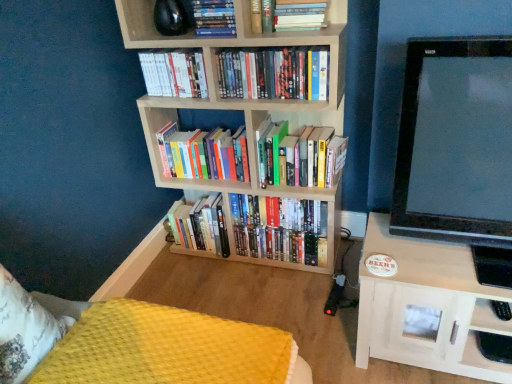
Describe the element at coordinates (288, 15) in the screenshot. Image resolution: width=512 pixels, height=384 pixels. I see `hardcover book at upper center, placed as the second book when sorted from top to bottom` at that location.

The image size is (512, 384). What do you see at coordinates (201, 226) in the screenshot? I see `hardcover books at center, the 8th book from the top` at bounding box center [201, 226].

Find the location of a particular element. white wood shelf at right is located at coordinates (425, 305).

Measure the distance between yellow textured blanket at lower left and camera.

The distance of yellow textured blanket at lower left from camera is 1.05 meters.

Where is `hardcover books at center, the 6th book viewed from the top`? This screenshot has height=384, width=512. hardcover books at center, the 6th book viewed from the top is located at coordinates (300, 155).

Find the location of a particular element. The width and height of the screenshot is (512, 384). light wood bookcase at center is located at coordinates (217, 84).

The width and height of the screenshot is (512, 384). I want to click on hardcover books at center, the fifth book when ordered from bottom to top, so click(274, 73).

Find the location of a particular element. The width and height of the screenshot is (512, 384). hardcover books at upper center, which is the eighth book from bottom to top is located at coordinates (214, 18).

Would you say hardcover book at upper center, placed as the second book when sorted from top to bottom, is outside hardcover books at center, the 6th book viewed from the top?

hardcover book at upper center, placed as the second book when sorted from top to bottom, lies outside hardcover books at center, the 6th book viewed from the top,'s area.

Based on the photo, is hardcover book at upper center, which is counted as the seventh book, starting from the bottom, next to hardcover books at center, the 6th book viewed from the top, and touching it?

No, hardcover book at upper center, which is counted as the seventh book, starting from the bottom, is not with hardcover books at center, the 6th book viewed from the top.

Between point (262, 12) and point (310, 178), which one is positioned in front?

The point (262, 12) is closer.

From the hardcover books at center, the 6th book viewed from the top, count 2nd books forward and point to it. Please provide its 2D coordinates.

[(288, 15)]

From the image's perspective, starting from the white wood shelf at right, which book is the 5th one above? Please provide its 2D coordinates.

[(274, 73)]

Looking at this image, considering the relative positions of white wood shelf at right and hardcover books at center, the fifth book when ordered from bottom to top, in the image provided, is white wood shelf at right to the right of hardcover books at center, the fifth book when ordered from bottom to top, from the viewer's perspective?

Correct, you'll find white wood shelf at right to the right of hardcover books at center, the fifth book when ordered from bottom to top.

From a real-world perspective, is white wood shelf at right physically located above or below hardcover books at center, placed as the fourth book when sorted from top to bottom?

Clearly, from a real-world perspective, white wood shelf at right is below hardcover books at center, placed as the fourth book when sorted from top to bottom.

Between white wood shelf at right and hardcover books at center, placed as the fourth book when sorted from top to bottom, which one has smaller size?

hardcover books at center, placed as the fourth book when sorted from top to bottom.

Which is correct: hardcover books at upper center, which is the eighth book from bottom to top, is inside hardcover book at upper center, placed as the second book when sorted from top to bottom, or outside of it?

hardcover books at upper center, which is the eighth book from bottom to top, is located beyond the bounds of hardcover book at upper center, placed as the second book when sorted from top to bottom.

Considering the sizes of objects hardcover books at upper center, acting as the 1th book starting from the top, and hardcover book at upper center, placed as the second book when sorted from top to bottom, in the image provided, who is shorter, hardcover books at upper center, acting as the 1th book starting from the top, or hardcover book at upper center, placed as the second book when sorted from top to bottom,?

Standing shorter between the two is hardcover book at upper center, placed as the second book when sorted from top to bottom.

Is hardcover books at upper center, acting as the 1th book starting from the top, positioned behind hardcover book at upper center, placed as the second book when sorted from top to bottom?

That is False.

Which of these two, hardcover books at upper center, which is the eighth book from bottom to top, or yellow textured blanket at lower left, is thinner?

Thinner between the two is hardcover books at upper center, which is the eighth book from bottom to top.

Is hardcover books at upper center, acting as the 1th book starting from the top, to the left of yellow textured blanket at lower left from the viewer's perspective?

Incorrect, hardcover books at upper center, acting as the 1th book starting from the top, is not on the left side of yellow textured blanket at lower left.

From a real-world perspective, relative to yellow textured blanket at lower left, is hardcover books at upper center, which is the eighth book from bottom to top, vertically above or below?

From a real-world perspective, hardcover books at upper center, which is the eighth book from bottom to top, is physically above yellow textured blanket at lower left.

Which object is closer to the camera taking this photo, hardcover books at center, which ranks as the 5th book in top-to-bottom order, or yellow textured blanket at lower left?

yellow textured blanket at lower left.

From the image's perspective, is hardcover books at center, placed as the fourth book when sorted from bottom to top, above or below yellow textured blanket at lower left?

Based on their image positions, hardcover books at center, placed as the fourth book when sorted from bottom to top, is located above yellow textured blanket at lower left.

Considering the sizes of hardcover books at center, which ranks as the 5th book in top-to-bottom order, and yellow textured blanket at lower left in the image, is hardcover books at center, which ranks as the 5th book in top-to-bottom order, wider or thinner than yellow textured blanket at lower left?

In the image, hardcover books at center, which ranks as the 5th book in top-to-bottom order, appears to be more narrow than yellow textured blanket at lower left.

Can you confirm if hardcover books at center, which ranks as the 5th book in top-to-bottom order, is positioned to the right of yellow textured blanket at lower left?

Yes.

In the scene shown: Is hardcover books at upper center, which is the eighth book from bottom to top, positioned far away from hardcover books at center, marked as the 2th book in a bottom-to-top arrangement?

No, hardcover books at upper center, which is the eighth book from bottom to top, is not far away from hardcover books at center, marked as the 2th book in a bottom-to-top arrangement.

Is the position of hardcover books at upper center, acting as the 1th book starting from the top, less distant than that of hardcover books at center, marked as the 2th book in a bottom-to-top arrangement?

Yes, hardcover books at upper center, acting as the 1th book starting from the top, is closer to the viewer.

Considering the sizes of hardcover books at upper center, which is the eighth book from bottom to top, and hardcover books at center, the seventh book when ordered from top to bottom, in the image, is hardcover books at upper center, which is the eighth book from bottom to top, wider or thinner than hardcover books at center, the seventh book when ordered from top to bottom,?

Clearly, hardcover books at upper center, which is the eighth book from bottom to top, has less width compared to hardcover books at center, the seventh book when ordered from top to bottom.

Is point (231, 6) farther from camera compared to point (277, 208)?

No, it is not.

Considering the points (178, 245) and (244, 14), which point is in front, point (178, 245) or point (244, 14)?

Point (244, 14)

What's the angular difference between hardcover books at center, the 8th book from the top, and light wood bookcase at center's facing directions?

The angular difference between hardcover books at center, the 8th book from the top, and light wood bookcase at center is 0.483 degrees.

Between hardcover books at center, the 8th book from the top, and light wood bookcase at center, which one has larger width?

light wood bookcase at center is wider.

Could you tell me if hardcover books at center, the 8th book from the top, is turned towards light wood bookcase at center?

Yes, hardcover books at center, the 8th book from the top, is aimed at light wood bookcase at center.

You are a GUI agent. You are given a task and a screenshot of the screen. Output one action in this format:
    pyautogui.click(x=<x>, y=<y>)
    Task: Click on the book lying on the right of hardcover book at upper center, which is counted as the seventh book, starting from the bottom
    
    Given the screenshot: What is the action you would take?
    click(300, 155)

Which book is the 3rd one when counting from the back of the white wood shelf at right? Please provide its 2D coordinates.

[(274, 73)]

From the image, which object appears to be nearer to hardcover books at center, the seventh book when ordered from top to bottom, hardcover books at center, placed as the fourth book when sorted from top to bottom, or yellow textured blanket at lower left?

Based on the image, hardcover books at center, placed as the fourth book when sorted from top to bottom, appears to be nearer to hardcover books at center, the seventh book when ordered from top to bottom.

Estimate the real-world distances between objects in this image. Which object is closer to hardcover books at center, which ranks as the 3th book in bottom-to-top order, hardcover books at center, marked as the 2th book in a bottom-to-top arrangement, or hardcover books at center, the fifth book when ordered from bottom to top?

hardcover books at center, marked as the 2th book in a bottom-to-top arrangement, lies closer to hardcover books at center, which ranks as the 3th book in bottom-to-top order, than the other object.

Considering their positions, is light wood bookcase at center positioned closer to hardcover book at upper center, placed as the second book when sorted from top to bottom, than black glossy tv at right?

light wood bookcase at center is positioned closer to the anchor hardcover book at upper center, placed as the second book when sorted from top to bottom.

Estimate the real-world distances between objects in this image. Which object is closer to hardcover books at upper center, which is the eighth book from bottom to top, black glossy tv at right or hardcover books at center, the 6th book viewed from the top?

hardcover books at center, the 6th book viewed from the top.

When comparing their distances from hardcover books at center, placed as the fourth book when sorted from top to bottom, does light wood bookcase at center or black glossy tv at right seem closer?

light wood bookcase at center is closer to hardcover books at center, placed as the fourth book when sorted from top to bottom.

Estimate the real-world distances between objects in this image. Which object is further from hardcover books at center, the seventh book when ordered from top to bottom, white wood shelf at right or hardcover books at center, the 6th book viewed from the top?

white wood shelf at right.

Which object lies further to the anchor point hardcover books at center, the seventh book when ordered from top to bottom, white paperback book at upper left, arranged as the 3th book when viewed from the top, or black glossy tv at right?

black glossy tv at right.

When comparing their distances from black glossy tv at right, does white wood shelf at right or yellow textured blanket at lower left seem closer?

white wood shelf at right is positioned closer to the anchor black glossy tv at right.

Where is `shelf located between yellow textured blanket at lower left and hardcover books at center, the first book ordered from the bottom, in the depth direction`? shelf located between yellow textured blanket at lower left and hardcover books at center, the first book ordered from the bottom, in the depth direction is located at coordinates (425, 305).

You are a GUI agent. You are given a task and a screenshot of the screen. Output one action in this format:
    pyautogui.click(x=<x>, y=<y>)
    Task: Click on the bookcase between white paperback book at upper left, which ranks as the sixth book in bottom-to-top order, and hardcover books at center, the first book ordered from the bottom, in the up-down direction
    
    Given the screenshot: What is the action you would take?
    pyautogui.click(x=217, y=84)

Find the location of `television between yellow textured blanket at lower left and hardcover books at center, marked as the 2th book in a bottom-to-top arrangement, in the front-back direction`. television between yellow textured blanket at lower left and hardcover books at center, marked as the 2th book in a bottom-to-top arrangement, in the front-back direction is located at coordinates click(x=455, y=142).

Find the location of `bookcase between yellow textured blanket at lower left and hardcover books at center, the first book ordered from the bottom, from front to back`. bookcase between yellow textured blanket at lower left and hardcover books at center, the first book ordered from the bottom, from front to back is located at coordinates (217, 84).